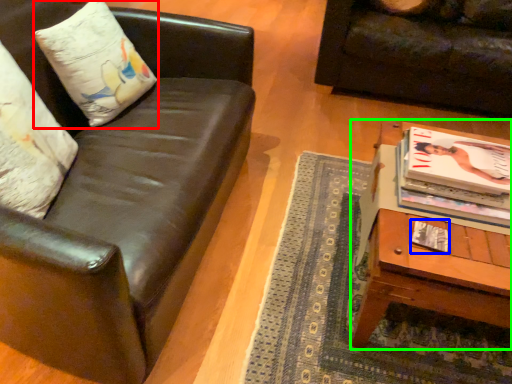
Question: Based on their relative distances, which object is farther from pillow (highlighted by a red box)? Choose from magazine (highlighted by a blue box) and table (highlighted by a green box).

Choices:
 (A) magazine
 (B) table

Answer: (A)